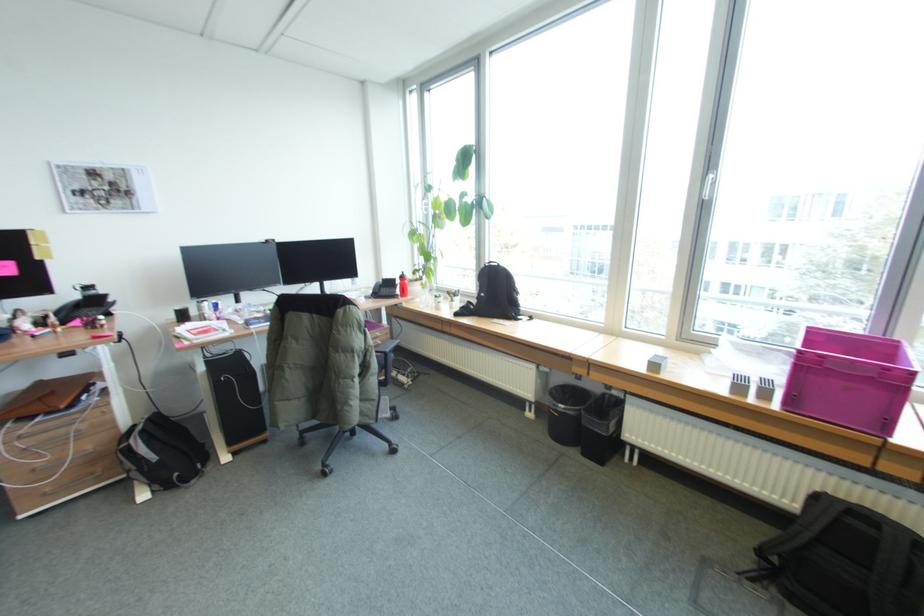
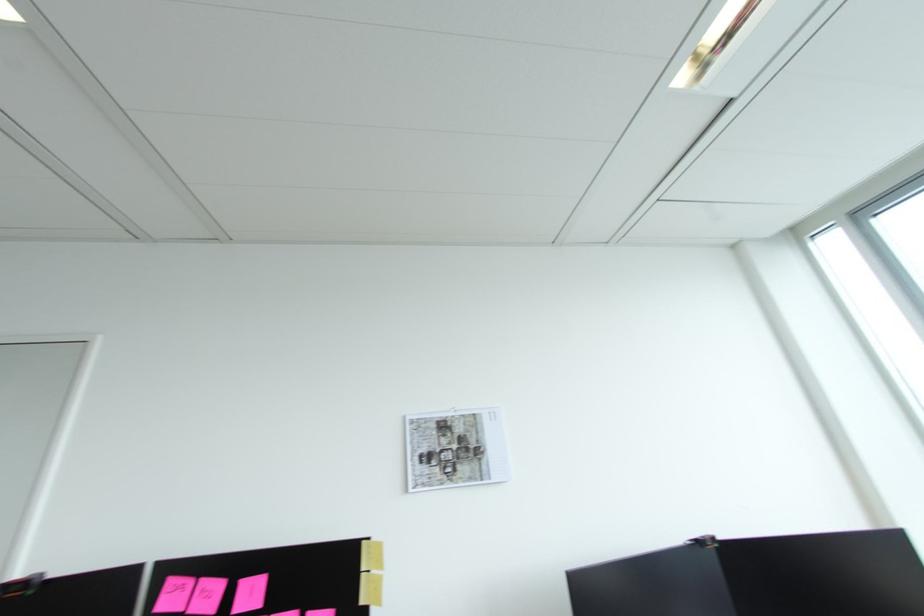
The point at [42,257] is marked in the first image. Where is the corresponding point in the second image?

(366, 602)